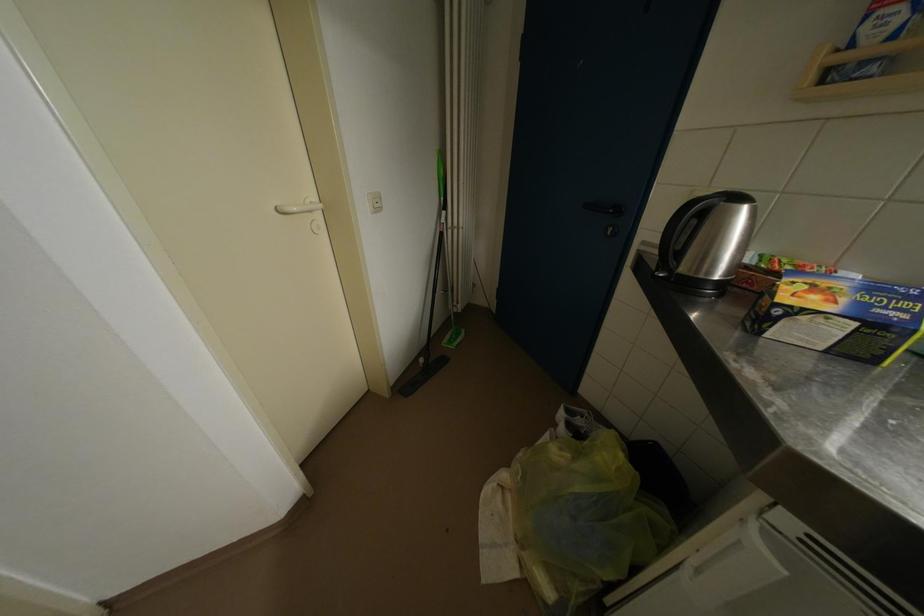
The width and height of the screenshot is (924, 616). Find the location of `yellow trash bag`. yellow trash bag is located at coordinates (581, 517).